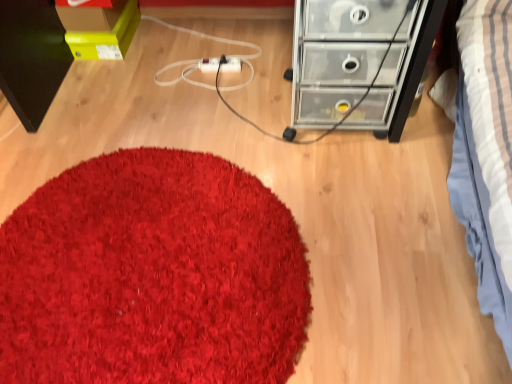
The image size is (512, 384). In order to click on free spot below shaggy red carpet at center (from a real-world perspective) in this screenshot , I will do click(x=133, y=251).